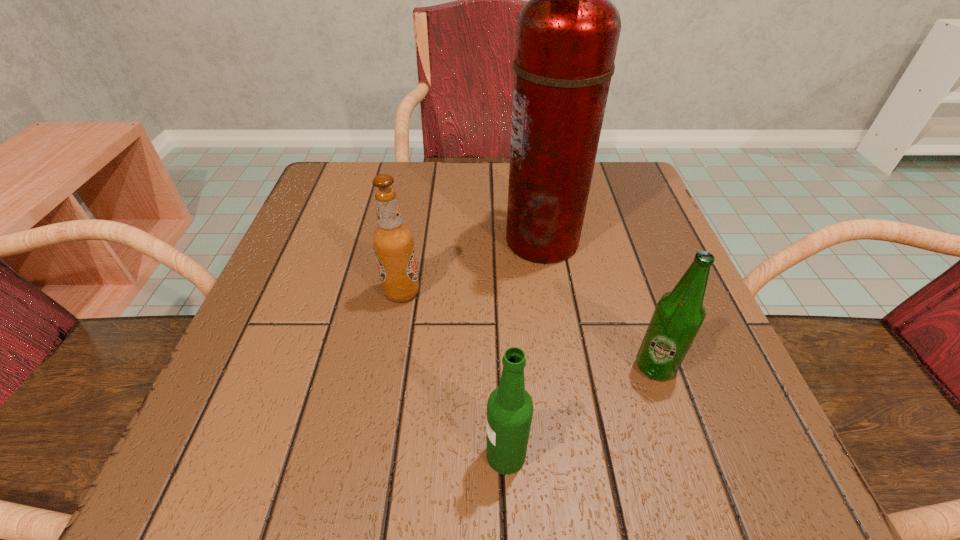
I want to click on free space between the fire extinguisher and the rightmost beer bottle, so click(599, 303).

Where is `unoccupied area between the rightmost beer bottle and the tallest object`? The width and height of the screenshot is (960, 540). unoccupied area between the rightmost beer bottle and the tallest object is located at coordinates (599, 303).

This screenshot has width=960, height=540. I want to click on empty space between the second nearest beer bottle and the second farthest object, so click(529, 329).

The height and width of the screenshot is (540, 960). I want to click on unoccupied area between the fire extinguisher and the leftmost object, so click(472, 266).

Where is `unoccupied area between the nearest object and the farthest beer bottle`? This screenshot has width=960, height=540. unoccupied area between the nearest object and the farthest beer bottle is located at coordinates (454, 373).

The width and height of the screenshot is (960, 540). Identify the location of empty space that is in between the farthest object and the third farthest object. (599, 303).

Find the location of `blank region between the nearest object and the farthest beer bottle`. blank region between the nearest object and the farthest beer bottle is located at coordinates (454, 373).

Identify the location of object that is the nearest to the fire extinguisher. The image size is (960, 540). (393, 241).

Locate an element on the screen. object that ranks as the second closest to the fire extinguisher is located at coordinates (679, 314).

Locate which beer bottle is the closest to the farthest object. Please provide its 2D coordinates. Your answer should be formatted as a tuple, i.e. [(x, y)], where the tuple contains the x and y coordinates of a point satisfying the conditions above.

[(393, 241)]